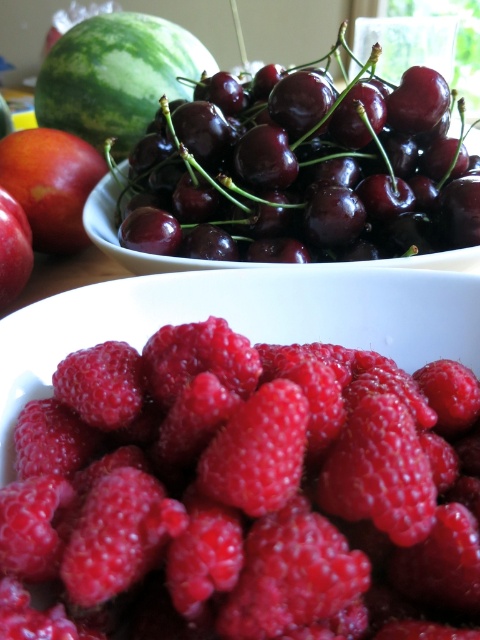
Consider the image. You are a fruit seller who wants to take a photo of the shiny red raspberry at center for an online listing. Your camera can focus clearly on objects within 8 inches. Will the raspberry be in focus?

The shiny red raspberry at center is 10.00 inches away from camera, which is beyond the camera focus range of 8 inches. Therefore, the raspberry will not be in focus.

You are arranging fruits on a table and see the green matte watermelon at upper left and the matte orange peach at upper left. Which fruit is positioned higher up in the image?

The green matte watermelon at upper left is located above the matte orange peach at upper left, so it is positioned higher up in the image.

You are a fruit vendor arranging a display. You have a shiny red raspberry at center and a green matte watermelon at upper left. Which fruit is closer to customers approaching from the front of the display?

The shiny red raspberry at center is closer to customers approaching from the front of the display because it is positioned in front of the green matte watermelon at upper left.